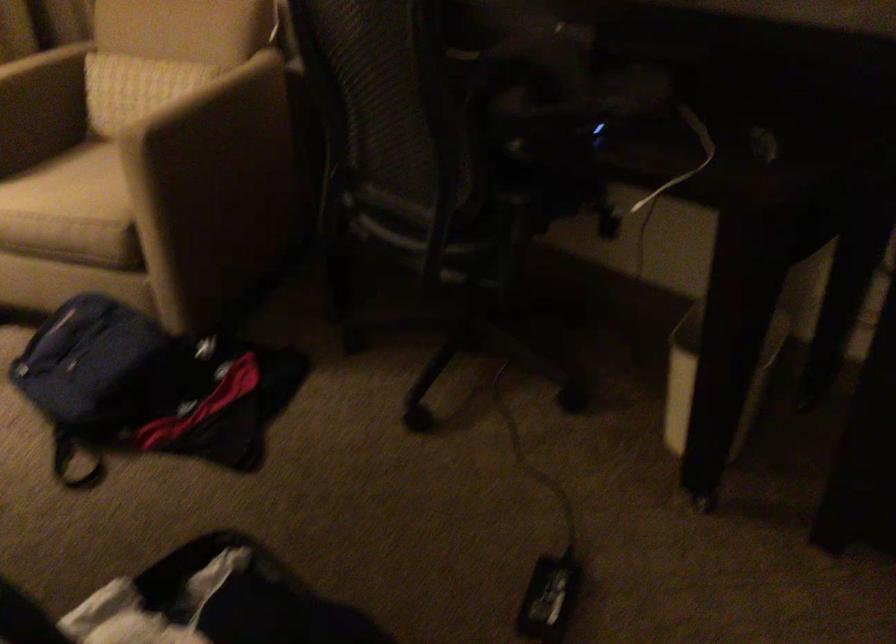
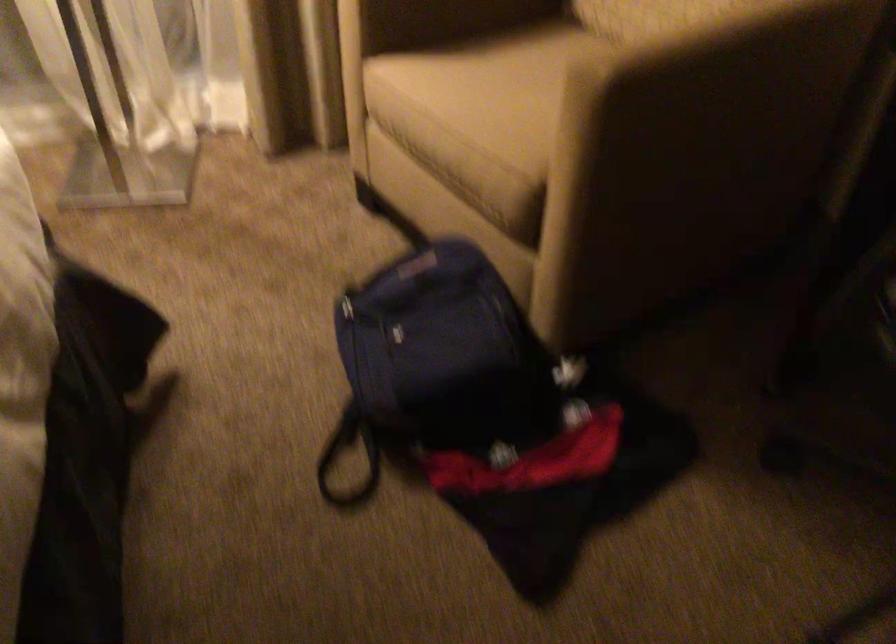
Where in the second image is the point corresponding to the point at 148,126 from the first image?

(617, 53)